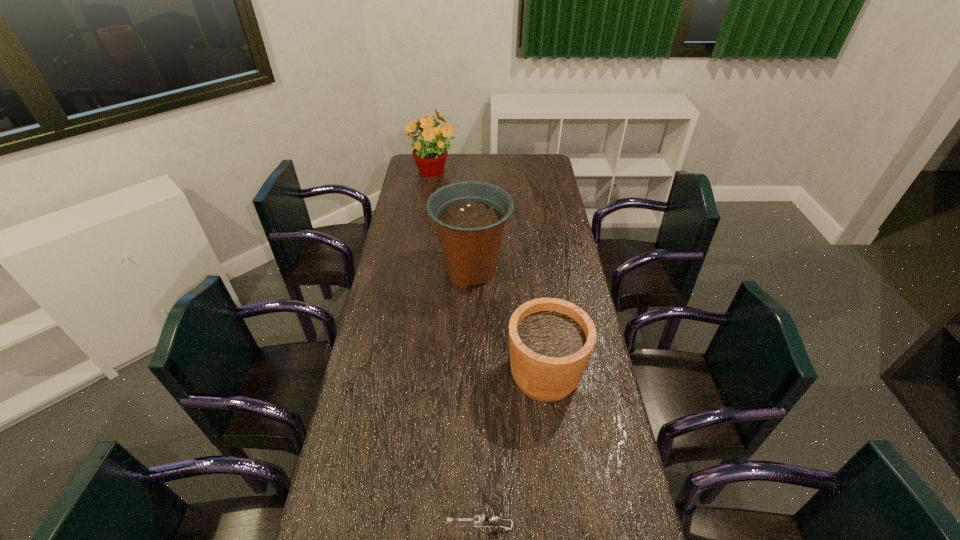
The image size is (960, 540). I want to click on vacant space that satisfies the following two spatial constraints: 1. on the front side of the nearest flowerpot; 2. aimed along the barrel of the shortest object, so click(564, 526).

Find the location of a particular element. The width and height of the screenshot is (960, 540). free space that satisfies the following two spatial constraints: 1. on the front side of the second shortest object; 2. aimed along the barrel of the shortest object is located at coordinates (564, 526).